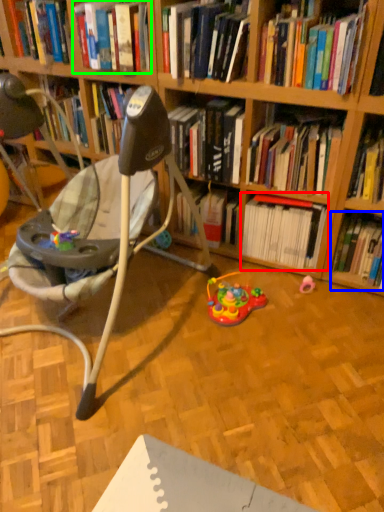
Question: Which object is positioned closest to book (highlighted by a red box)? Select from book (highlighted by a blue box) and book (highlighted by a green box).

Choices:
 (A) book
 (B) book

Answer: (A)